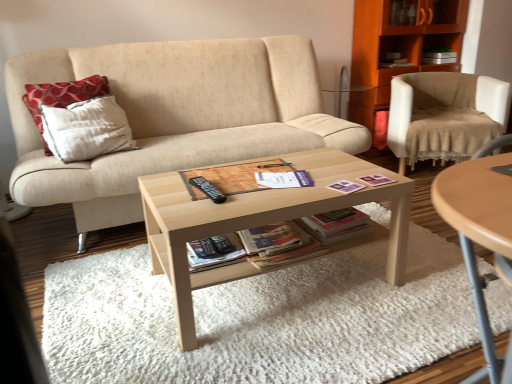
Find the location of a particular element. vacant space behind white paper at center is located at coordinates (292, 170).